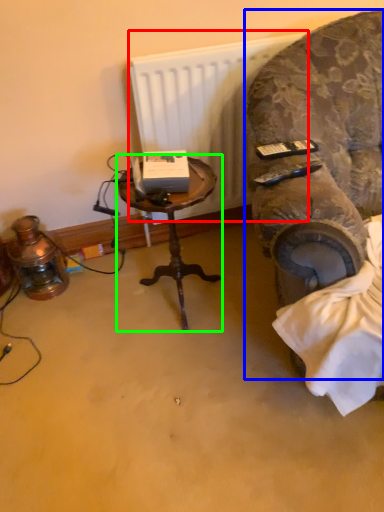
Question: Which is farther away from radiator (highlighted by a red box)? chair (highlighted by a blue box) or table (highlighted by a green box)?

Choices:
 (A) chair
 (B) table

Answer: (B)